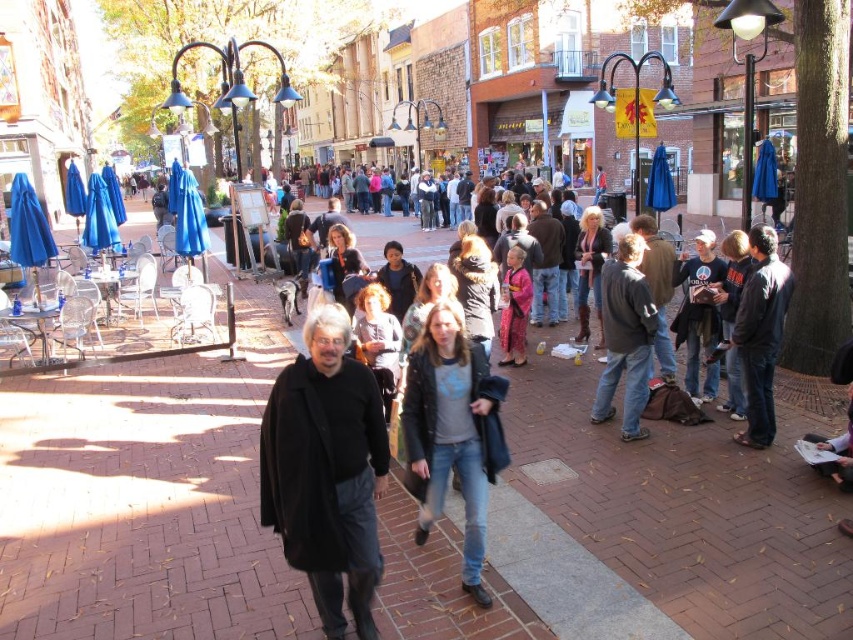
You are a fashion designer observing the pedestrians in the plaza. You notice the black leather jacket at right and the dark blue jeans at center. Which clothing item appears bigger in size?

The black leather jacket at right has a larger size compared to the dark blue jeans at center, so the black leather jacket at right appears bigger in size.

From the picture: You are a delivery robot with a width of 1 meter. You need to pass between the black leather jacket at right and the dark blue jeans at center to deliver a package. Can you fit through the space between them?

The distance between the black leather jacket at right and the dark blue jeans at center is 1.49 meters. Since the robot is 1 meter wide, it can fit through the space as the distance is slightly larger than the robot.

You are a photographer standing in the plaza and want to take a photo of the dark gray jacket at center and dark blue jeans at center. To ensure both are in frame, should you adjust your camera angle to the left or right?

The dark gray jacket at center is positioned on the left side of dark blue jeans at center, so you should adjust your camera angle to the left to include both in the frame.